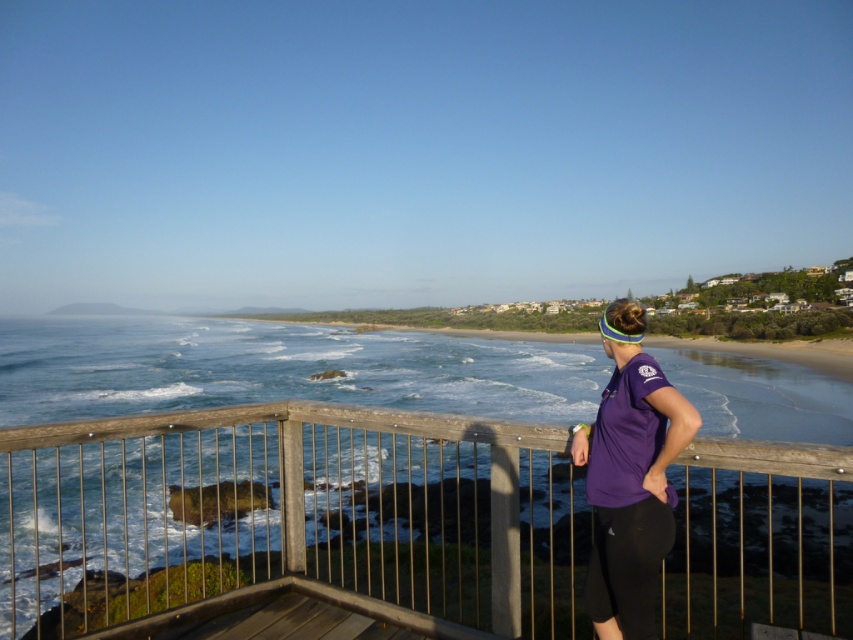
Question: Can you confirm if wooden railing at center is thinner than purple fabric shirt at center?

Choices:
 (A) no
 (B) yes

Answer: (A)

Question: Which of the following is the closest to the observer?

Choices:
 (A) purple fabric shirt at center
 (B) wooden railing at center

Answer: (A)

Question: Which point is farther from the camera taking this photo?

Choices:
 (A) (634, 424)
 (B) (802, 628)

Answer: (B)

Question: From the image, what is the correct spatial relationship of wooden railing at center in relation to purple fabric shirt at center?

Choices:
 (A) left
 (B) right

Answer: (A)

Question: Among these objects, which one is nearest to the camera?

Choices:
 (A) wooden railing at center
 (B) purple fabric shirt at center

Answer: (B)

Question: Is wooden railing at center to the right of purple fabric shirt at center from the viewer's perspective?

Choices:
 (A) no
 (B) yes

Answer: (A)